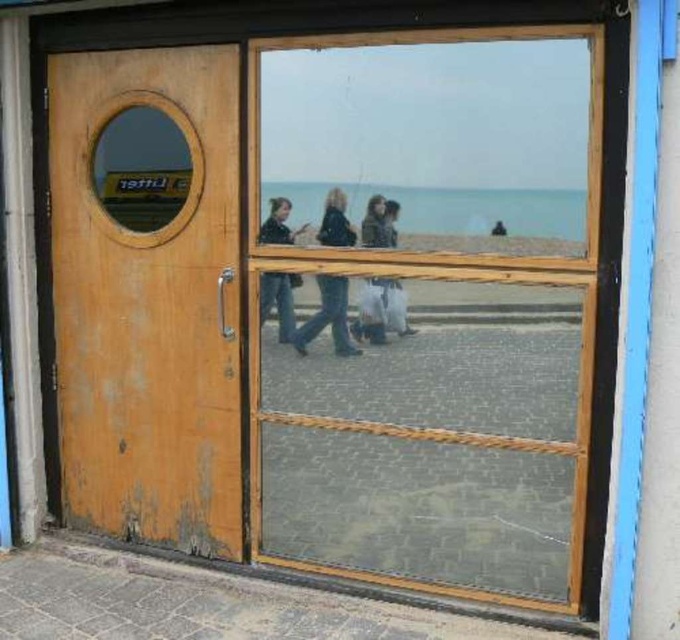
Question: Which of these objects is positioned closest to the matte black jacket at center?

Choices:
 (A) weathered wood door at left
 (B) dark blue jeans at center
 (C) dark brown leather jacket at center

Answer: (B)

Question: Estimate the real-world distances between objects in this image. Which object is closer to the transparent glass door at center?

Choices:
 (A) weathered wood door at left
 (B) dark brown leather jacket at center
 (C) matte black jacket at center
 (D) dark blue jeans at center

Answer: (D)

Question: Can you confirm if dark blue jeans at center is thinner than dark brown leather jacket at center?

Choices:
 (A) yes
 (B) no

Answer: (B)

Question: Does transparent glass door at center lie behind matte black jacket at center?

Choices:
 (A) no
 (B) yes

Answer: (A)

Question: Which object is farther from the camera taking this photo?

Choices:
 (A) transparent glass door at center
 (B) dark brown leather jacket at center
 (C) dark blue jeans at center

Answer: (C)

Question: Does matte black jacket at center appear on the right side of dark brown leather jacket at center?

Choices:
 (A) no
 (B) yes

Answer: (A)